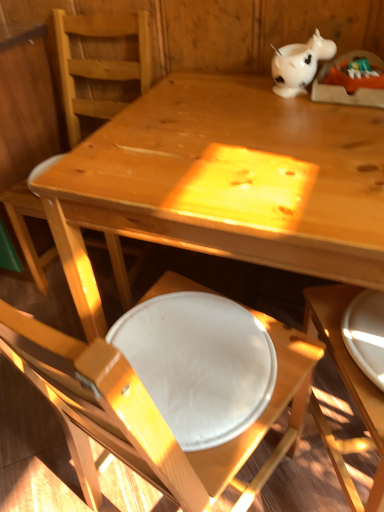
In order to click on vacant area on top of white glossy plate at lower center, acting as the first chair starting from the front (from a real-world perspective) in this screenshot , I will do `click(190, 345)`.